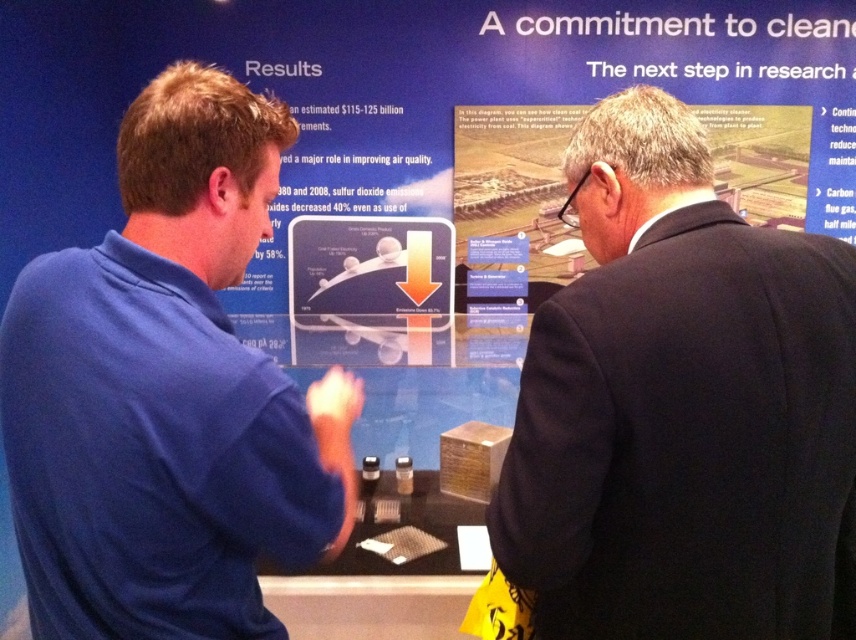
Who is more distant from viewer, (696, 536) or (102, 534)?

Point (696, 536)

Does black suit at right have a greater width compared to blue fabric shirt at left?

Indeed, black suit at right has a greater width compared to blue fabric shirt at left.

Measure the distance between point (768, 344) and camera.

86.17 centimeters

At what (x,y) coordinates should I click in order to perform the action: click on black suit at right. Please return your answer as a coordinate pair (x, y). This screenshot has width=856, height=640. Looking at the image, I should click on (682, 406).